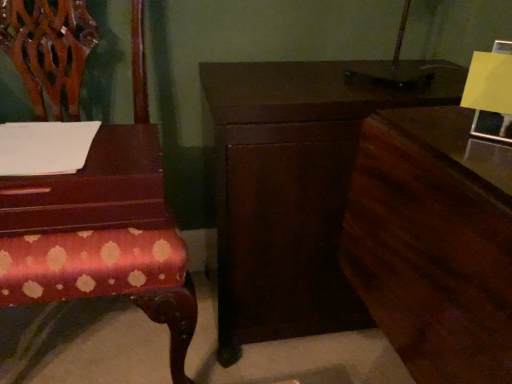
Question: Are mahogany wood table at left and dark wood dresser at right far apart?

Choices:
 (A) no
 (B) yes

Answer: (A)

Question: From the image's perspective, is mahogany wood table at left located beneath dark wood dresser at right?

Choices:
 (A) no
 (B) yes

Answer: (A)

Question: Can you confirm if mahogany wood table at left is thinner than dark wood dresser at right?

Choices:
 (A) no
 (B) yes

Answer: (B)

Question: Can you confirm if mahogany wood table at left is taller than dark wood dresser at right?

Choices:
 (A) yes
 (B) no

Answer: (B)

Question: Considering the relative positions of mahogany wood table at left and dark wood dresser at right in the image provided, is mahogany wood table at left to the right of dark wood dresser at right from the viewer's perspective?

Choices:
 (A) no
 (B) yes

Answer: (A)

Question: From the image's perspective, does mahogany wood table at left appear higher than dark wood dresser at right?

Choices:
 (A) no
 (B) yes

Answer: (B)

Question: Is mahogany wood table at left oriented towards polished wood chair at left?

Choices:
 (A) no
 (B) yes

Answer: (B)

Question: Is mahogany wood table at left far from polished wood chair at left?

Choices:
 (A) yes
 (B) no

Answer: (B)

Question: Considering the relative sizes of mahogany wood table at left and polished wood chair at left in the image provided, is mahogany wood table at left thinner than polished wood chair at left?

Choices:
 (A) yes
 (B) no

Answer: (A)

Question: From the image's perspective, does mahogany wood table at left appear lower than polished wood chair at left?

Choices:
 (A) yes
 (B) no

Answer: (B)

Question: Is mahogany wood table at left oriented away from polished wood chair at left?

Choices:
 (A) no
 (B) yes

Answer: (B)

Question: Considering the relative positions of mahogany wood table at left and polished wood chair at left in the image provided, is mahogany wood table at left to the left of polished wood chair at left from the viewer's perspective?

Choices:
 (A) yes
 (B) no

Answer: (B)

Question: From a real-world perspective, is polished wood chair at left located higher than dark wood nightstand at center?

Choices:
 (A) no
 (B) yes

Answer: (B)